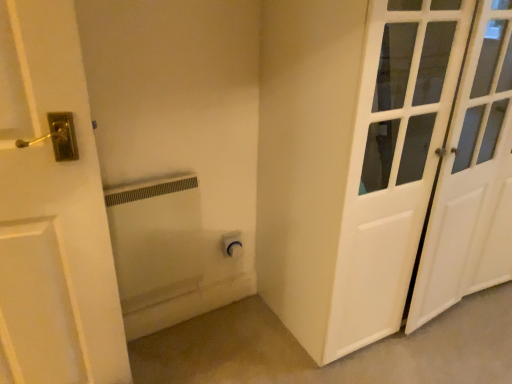
Image resolution: width=512 pixels, height=384 pixels. What do you see at coordinates (335, 361) in the screenshot?
I see `white matte outlet at lower center` at bounding box center [335, 361].

This screenshot has height=384, width=512. I want to click on white matte radiator at center, so click(x=170, y=254).

Which is closer, (187, 355) or (333, 211)?

Point (187, 355) appears to be farther away from the viewer than point (333, 211).

Can you confirm if white matte outlet at lower center is positioned to the left of white glossy door at right?

Indeed, white matte outlet at lower center is positioned on the left side of white glossy door at right.

Is white matte outlet at lower center outside of white glossy door at right?

That's correct, white matte outlet at lower center is outside of white glossy door at right.

Who is more distant, white matte outlet at lower center or white glossy door at right?

white matte outlet at lower center is further from the camera.

Is there a large distance between white glossy door at right and white matte radiator at center?

No, there isn't a large distance between white glossy door at right and white matte radiator at center.

What's the angular difference between white glossy door at right and white matte radiator at center's facing directions?

1.15 degrees separate the facing orientations of white glossy door at right and white matte radiator at center.

Considering the positions of point (433, 306) and point (126, 336), is point (433, 306) closer or farther from the camera than point (126, 336)?

Clearly, point (433, 306) is more distant from the camera than point (126, 336).

Considering the relative positions of white glossy door at right and white matte radiator at center in the image provided, is white glossy door at right to the right of white matte radiator at center from the viewer's perspective?

Correct, you'll find white glossy door at right to the right of white matte radiator at center.

From a real-world perspective, which is physically below, white matte radiator at center or white glossy door at right?

In real-world perspective, white matte radiator at center is lower.

From the image's perspective, who appears lower, white matte radiator at center or white glossy door at right?

white matte radiator at center.

Locate an element on the screen. Image resolution: width=512 pixels, height=384 pixels. door in front of the white matte radiator at center is located at coordinates (381, 163).

Is white matte radiator at center positioned with its back to white glossy door at right?

No.

Can you confirm if white glossy door at right is positioned to the left of white matte outlet at lower center?

Incorrect, white glossy door at right is not on the left side of white matte outlet at lower center.

Do you think white glossy door at right is within white matte outlet at lower center, or outside of it?

white glossy door at right lies outside white matte outlet at lower center.

From the image's perspective, who appears lower, white glossy door at right or white matte outlet at lower center?

From the image's view, white matte outlet at lower center is below.

How different are the orientations of white glossy door at right and white matte outlet at lower center in degrees?

They differ by 90.1 degrees in their facing directions.

Find the location of a particular element. concrete on the right of white matte radiator at center is located at coordinates (335, 361).

What's the angular difference between white matte outlet at lower center and white matte radiator at center's facing directions?

The angle between the facing direction of white matte outlet at lower center and the facing direction of white matte radiator at center is 88.9 degrees.

Looking at the image, does white matte outlet at lower center seem bigger or smaller compared to white matte radiator at center?

Clearly, white matte outlet at lower center is larger in size than white matte radiator at center.

From the image's perspective, is white matte radiator at center above or below white matte outlet at lower center?

Based on their image positions, white matte radiator at center is located above white matte outlet at lower center.

Does white matte radiator at center have a smaller size compared to white matte outlet at lower center?

Yes, white matte radiator at center is smaller than white matte outlet at lower center.

Is point (190, 238) more distant than point (212, 320)?

No, (190, 238) is in front of (212, 320).

This screenshot has height=384, width=512. I want to click on concrete on the left of white glossy door at right, so click(x=335, y=361).

What are the coordinates of `door in front of the white matte radiator at center` in the screenshot? It's located at (381, 163).

From the image, which object appears to be farther from white matte outlet at lower center, white glossy door at right or white matte radiator at center?

white glossy door at right is further to white matte outlet at lower center.

Based on their spatial positions, is white matte outlet at lower center or white glossy door at right closer to white matte radiator at center?

Based on the image, white matte outlet at lower center appears to be nearer to white matte radiator at center.

Which object lies nearer to the anchor point white glossy door at right, white matte radiator at center or white matte outlet at lower center?

white matte outlet at lower center is closer to white glossy door at right.

Based on their spatial positions, is white glossy door at right or white matte outlet at lower center further from white matte radiator at center?

white glossy door at right lies further to white matte radiator at center than the other object.

When comparing their distances from white matte outlet at lower center, does white matte radiator at center or white glossy door at right seem further?

Among the two, white glossy door at right is located further to white matte outlet at lower center.

Which object lies further to the anchor point white glossy door at right, white matte outlet at lower center or white matte radiator at center?

white matte radiator at center is positioned further to the anchor white glossy door at right.

Identify the location of concrete between white matte radiator at center and white glossy door at right in the horizontal direction. The image size is (512, 384). (335, 361).